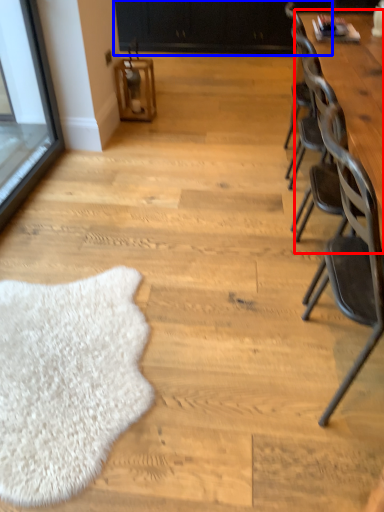
Question: Which object is further to the camera taking this photo, table (highlighted by a red box) or dresser (highlighted by a blue box)?

Choices:
 (A) table
 (B) dresser

Answer: (B)